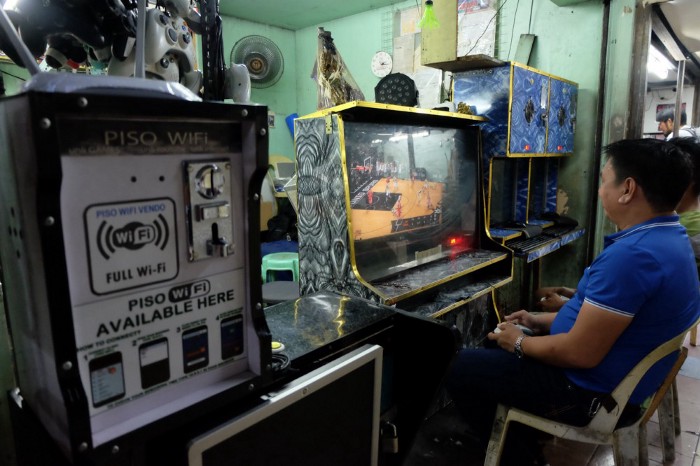
At what (x,y) coordinates should I click in order to perform the action: click on clock. Please return your answer as a coordinate pair (x, y). Looking at the image, I should click on (379, 65).